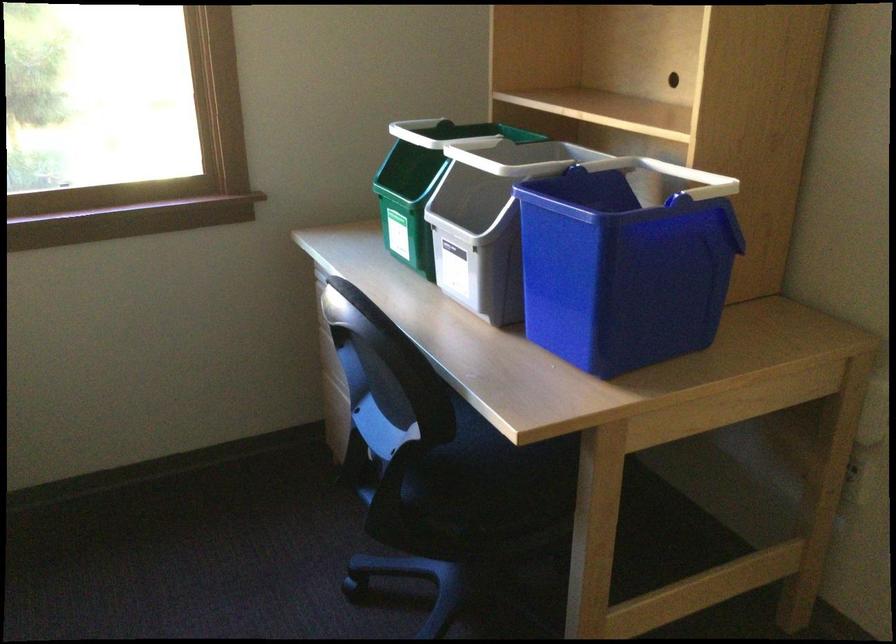
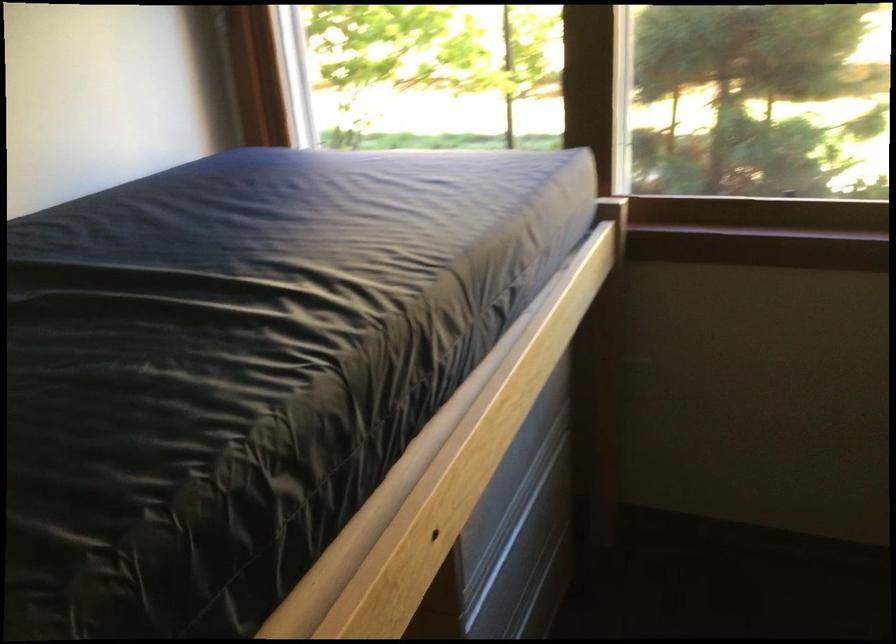
Question: The camera is either moving clockwise (left) or counter-clockwise (right) around the object. The first image is from the beginning of the video and the second image is from the end. Is the camera moving left or right when shooting the video?

Choices:
 (A) Left
 (B) Right

Answer: (B)